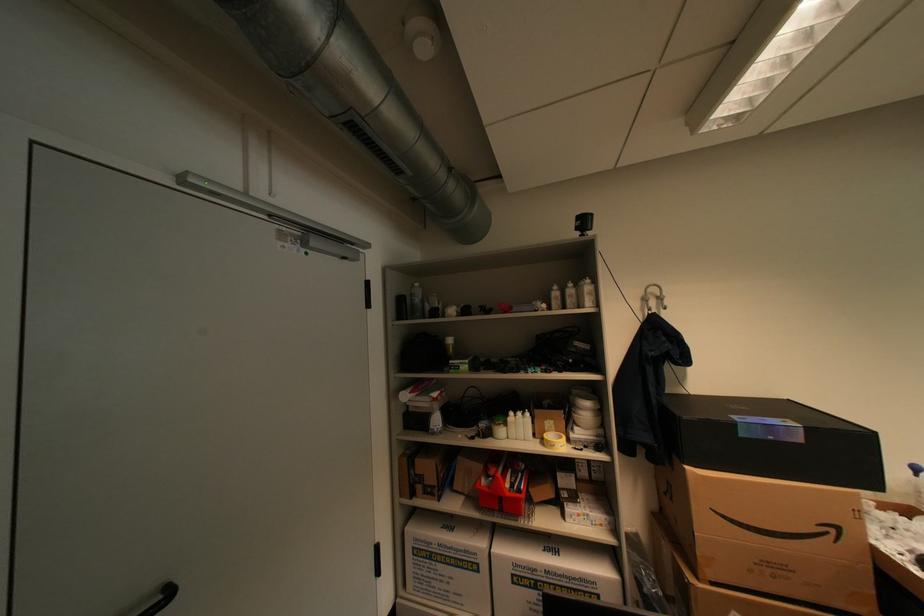
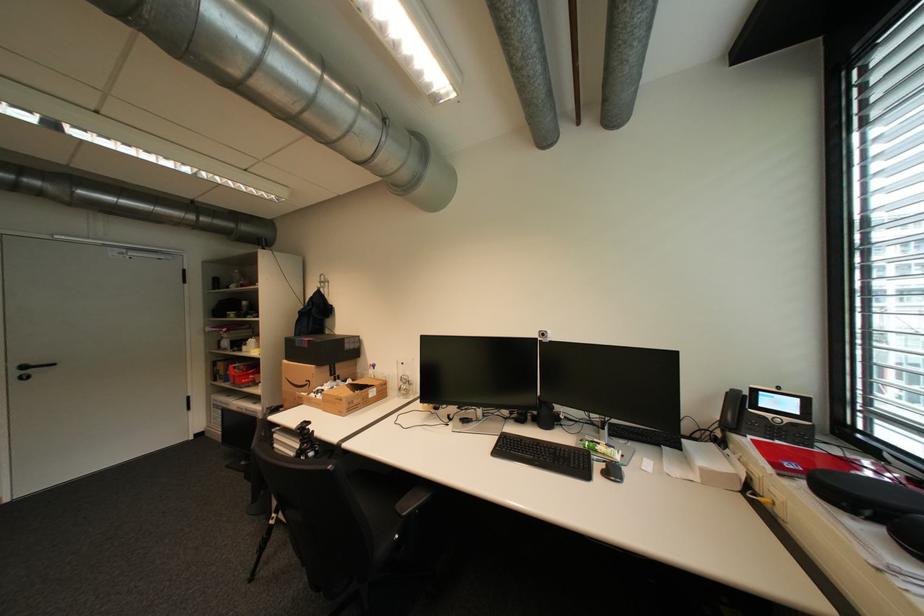
The point at (x=780, y=438) is marked in the first image. Where is the corresponding point in the second image?

(310, 346)